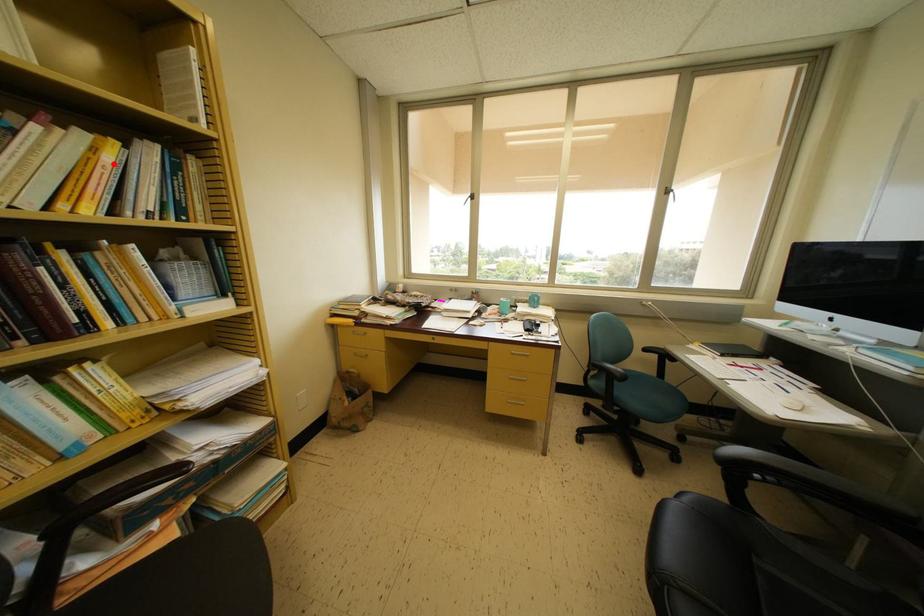
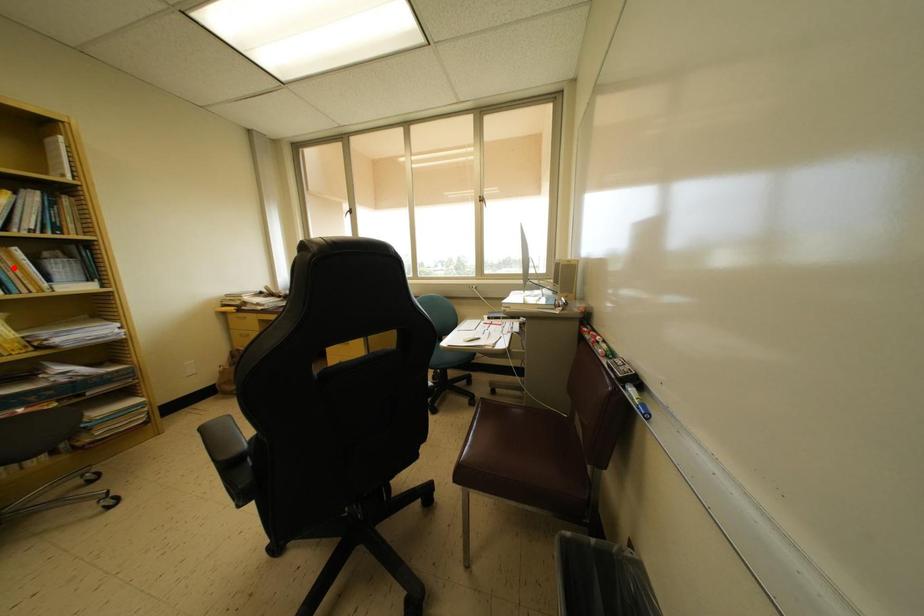
I am providing you with two images of the same scene from different viewpoints. A red point is marked on the first image and another point is marked on the second image. Is the marked point in image1 the same physical position as the marked point in image2?

No